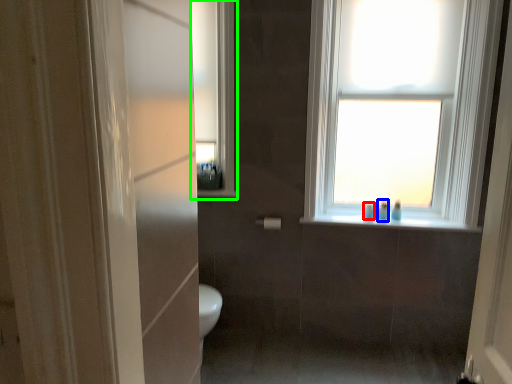
Question: Which object is the closest to the toiletry (highlighted by a red box)? Choose among these: toiletry (highlighted by a blue box) or medicine cabinet (highlighted by a green box).

Choices:
 (A) toiletry
 (B) medicine cabinet

Answer: (A)